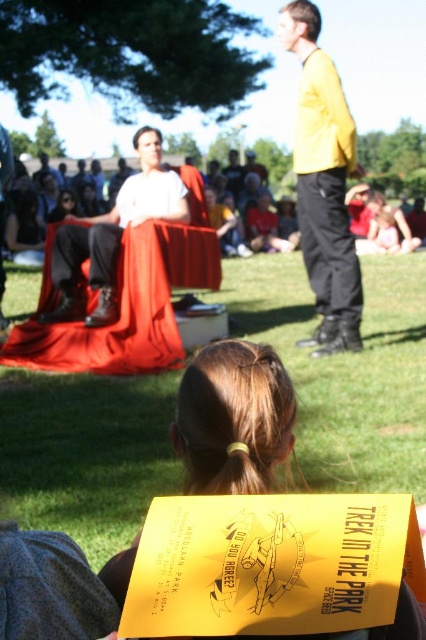
Question: Estimate the real-world distances between objects in this image. Which object is closer to the yellow matte jacket at upper right?

Choices:
 (A) matte black dress at center
 (B) green grass at center
 (C) matte white shirt at center
 (D) brown hair at lower center

Answer: (C)

Question: Estimate the real-world distances between objects in this image. Which object is closer to the green grass at center?

Choices:
 (A) matte white shirt at center
 (B) brown hair at lower center
 (C) matte black dress at center

Answer: (A)

Question: Can you confirm if green grass at center is thinner than matte white shirt at center?

Choices:
 (A) yes
 (B) no

Answer: (A)

Question: Is green grass at center smaller than yellow matte jacket at upper right?

Choices:
 (A) yes
 (B) no

Answer: (A)

Question: Does yellow matte jacket at upper right appear on the left side of matte white shirt at center?

Choices:
 (A) yes
 (B) no

Answer: (B)

Question: Among these points, which one is nearest to the camera?

Choices:
 (A) (9, 470)
 (B) (321, 276)

Answer: (A)